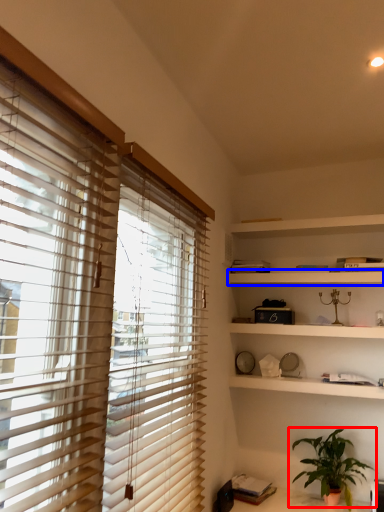
Question: Which point is closer to the camera, houseplant (highlighted by a red box) or shelf (highlighted by a blue box)?

Choices:
 (A) houseplant
 (B) shelf

Answer: (A)